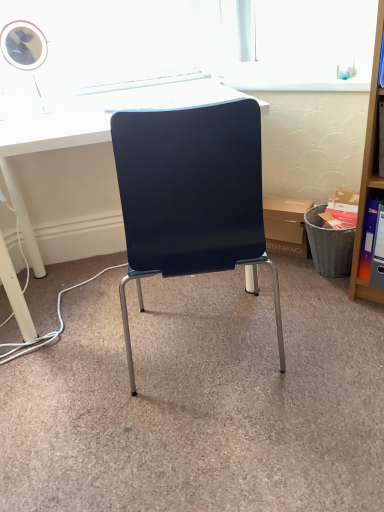
This screenshot has height=512, width=384. Find the location of `vacant area situated below white glossy desk at center (from a real-world perspective)`. vacant area situated below white glossy desk at center (from a real-world perspective) is located at coordinates (114, 293).